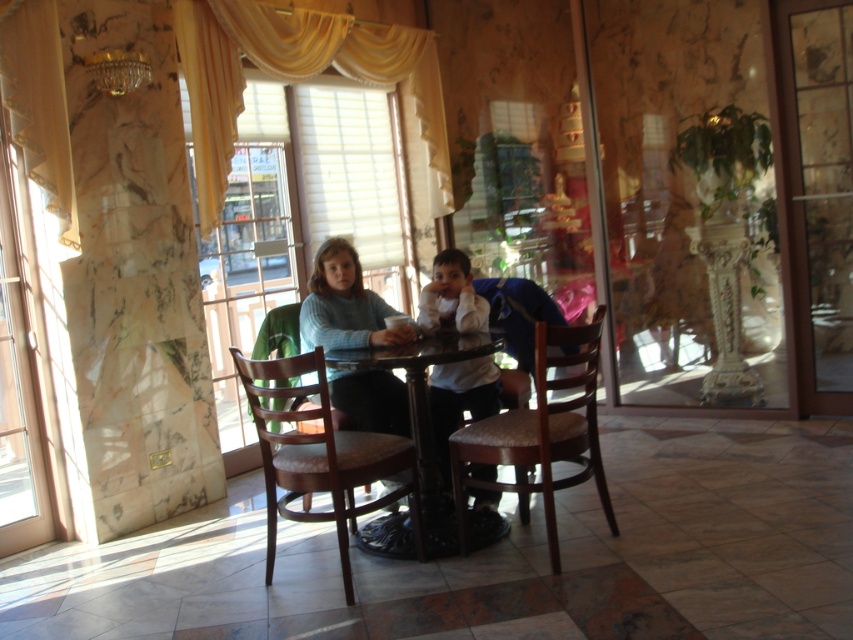
Question: Does transparent glass door at center appear over white matte shirt at center?

Choices:
 (A) no
 (B) yes

Answer: (B)

Question: Can you confirm if transparent glass door at center is positioned to the left of matte blue sweater at center?

Choices:
 (A) no
 (B) yes

Answer: (B)

Question: Which object is positioned farthest from the transparent glass door at center?

Choices:
 (A) wooden polished table at center
 (B) brown leather chair at center
 (C) wooden chair at center

Answer: (C)

Question: Which object is closer to the camera taking this photo?

Choices:
 (A) wooden polished table at center
 (B) transparent glass door at center

Answer: (A)

Question: Which point is closer to the camera taking this photo?

Choices:
 (A) (367, 340)
 (B) (566, 426)

Answer: (B)

Question: Can you confirm if transparent glass door at center is positioned to the left of matte blue sweater at center?

Choices:
 (A) no
 (B) yes

Answer: (B)